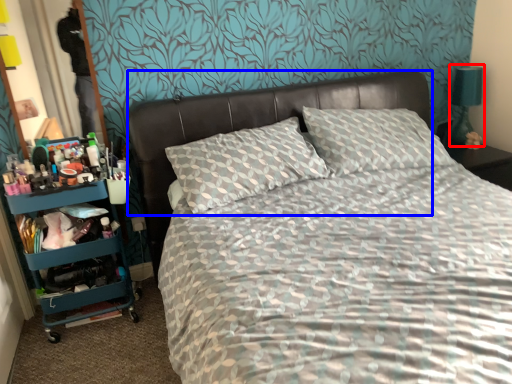
Question: Which object is further to the camera taking this photo, bedside lamp (highlighted by a red box) or headboard (highlighted by a blue box)?

Choices:
 (A) bedside lamp
 (B) headboard

Answer: (A)